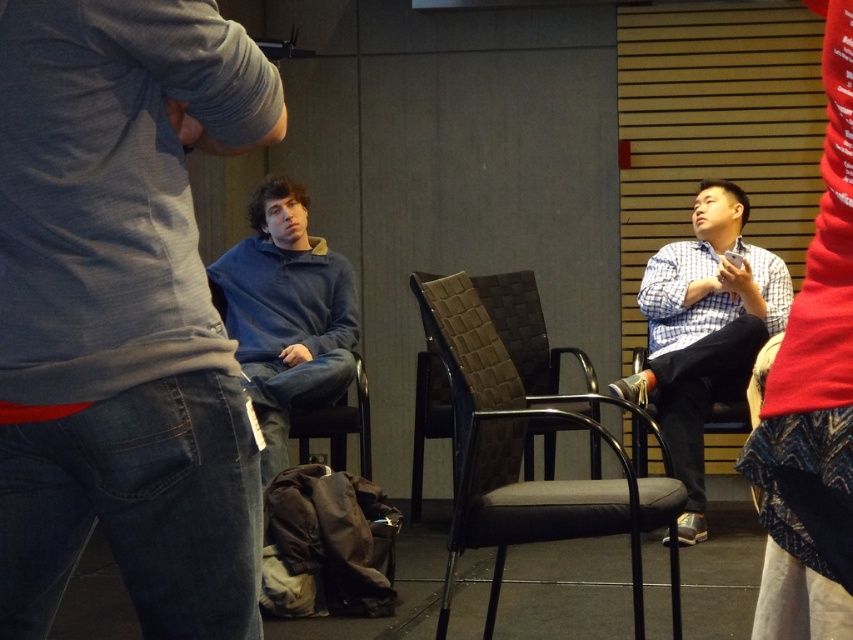
Question: Is blue cotton sweater at center above blue fleece at center?

Choices:
 (A) no
 (B) yes

Answer: (A)

Question: Which object appears closest to the camera in this image?

Choices:
 (A) checkered fabric shirt at right
 (B) brown woven chair at center
 (C) black woven fabric chair at center

Answer: (C)

Question: Which is farther from the brown woven chair at center?

Choices:
 (A) checkered fabric shirt at right
 (B) blue cotton sweater at center

Answer: (B)

Question: Can you confirm if black woven fabric chair at center is bigger than blue fleece at center?

Choices:
 (A) no
 (B) yes

Answer: (B)

Question: Does checkered fabric shirt at right come behind blue fleece at center?

Choices:
 (A) no
 (B) yes

Answer: (B)

Question: Which is farther from the brown woven chair at center?

Choices:
 (A) checkered fabric shirt at right
 (B) black woven fabric chair at center
 (C) blue cotton sweater at center

Answer: (C)